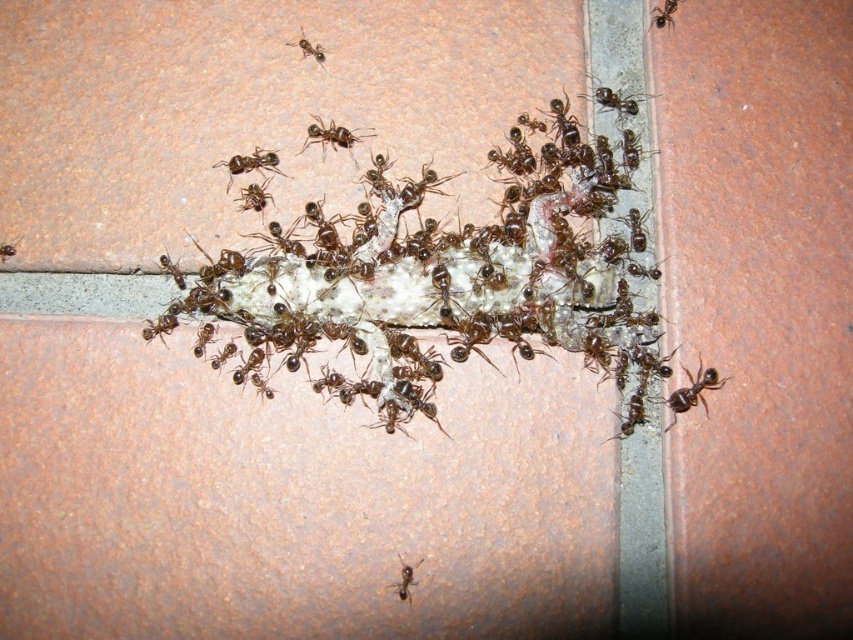
You are an exterminator examining the scene. You notice the brown shiny ant at upper right and the black glossy ant at upper left. Which ant is closer to your perspective?

The brown shiny ant at upper right is closer to your perspective because it is positioned further to the viewer than the black glossy ant at upper left.

You are an exterminator who needs to place a bait station between the brown glossy ant at upper center and the brown matte ant at lower center. The bait station requires a minimum of 50 centimeters of space between the ants to be effective. Can the bait station be placed effectively between them?

The distance between the brown glossy ant at upper center and the brown matte ant at lower center is 64.11 centimeters, which exceeds the required 50 centimeters. Therefore, the bait station can be placed effectively between them.

You are a photographer trying to capture a closeup of the brown glossy ant at upper center. You notice that the camera focus is currently on the point at coordinates point (614, 99). Is the focus correctly placed on the brown glossy ant at upper center?

Yes, the focus is correctly placed on the brown glossy ant at upper center because the point (614, 99) corresponds to the brown glossy ant at upper center.